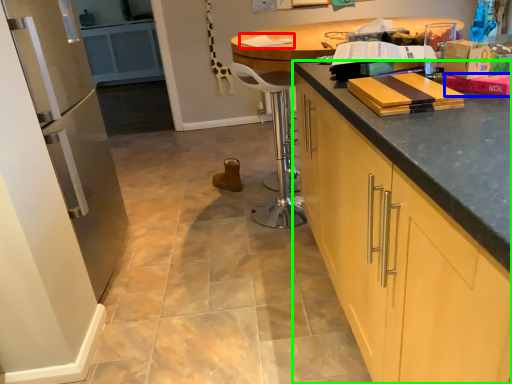
Question: Which object is positioned farthest from book (highlighted by a red box)? Select from book (highlighted by a blue box) and cabinetry (highlighted by a green box).

Choices:
 (A) book
 (B) cabinetry

Answer: (B)